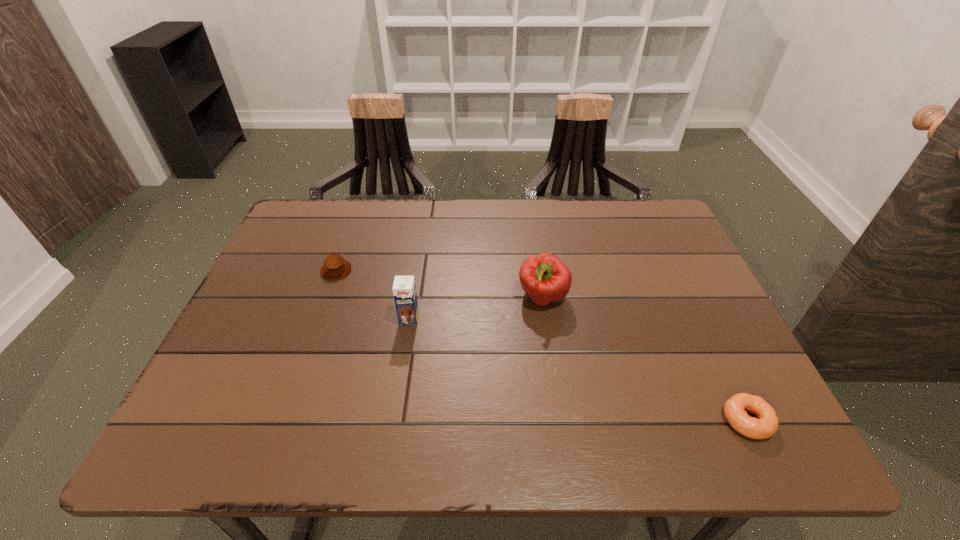
Where is `object located in the left edge section of the desktop`? object located in the left edge section of the desktop is located at coordinates (335, 267).

At what (x,y) coordinates should I click in order to perform the action: click on object located in the right edge section of the desktop. Please return your answer as a coordinate pair (x, y). Looking at the image, I should click on (735, 408).

At what (x,y) coordinates should I click in order to perform the action: click on object present at the near right corner. Please return your answer as a coordinate pair (x, y). The width and height of the screenshot is (960, 540). Looking at the image, I should click on coord(735,408).

This screenshot has width=960, height=540. In the image, there is a desktop. In order to click on vacant space at the far edge in this screenshot , I will do `click(467, 212)`.

Where is `blank space at the near edge`? blank space at the near edge is located at coordinates (499, 449).

You are a GUI agent. You are given a task and a screenshot of the screen. Output one action in this format:
    pyautogui.click(x=<x>, y=<y>)
    Task: Click on the free space at the left edge of the desktop
    
    Given the screenshot: What is the action you would take?
    pyautogui.click(x=297, y=302)

At what (x,y) coordinates should I click in order to perform the action: click on free point at the right edge. Please return your answer as a coordinate pair (x, y). This screenshot has height=540, width=960. Looking at the image, I should click on (649, 292).

Where is `free space at the far left corner of the desktop`? The height and width of the screenshot is (540, 960). free space at the far left corner of the desktop is located at coordinates (348, 208).

Find the location of a particular element. vacant position at the far right corner of the desktop is located at coordinates (615, 224).

The width and height of the screenshot is (960, 540). Find the location of `free area in between the second object from left to right and the muffin`. free area in between the second object from left to right and the muffin is located at coordinates (372, 295).